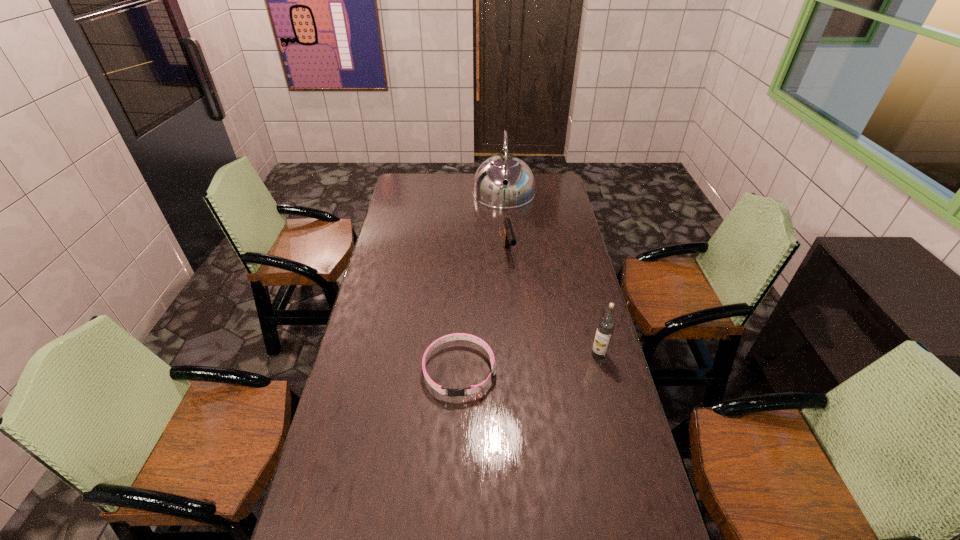
The image size is (960, 540). Identify the location of vacant spot on the desktop that is between the shortest object and the vodka and is positioned at the barrel of the third nearest object. (537, 362).

At what (x,y) coordinates should I click in order to perform the action: click on free spot on the desktop that is between the dog collar and the rightmost object and is positioned from the spout of the tallest object. Please return your answer as a coordinate pair (x, y). This screenshot has width=960, height=540. Looking at the image, I should click on (511, 365).